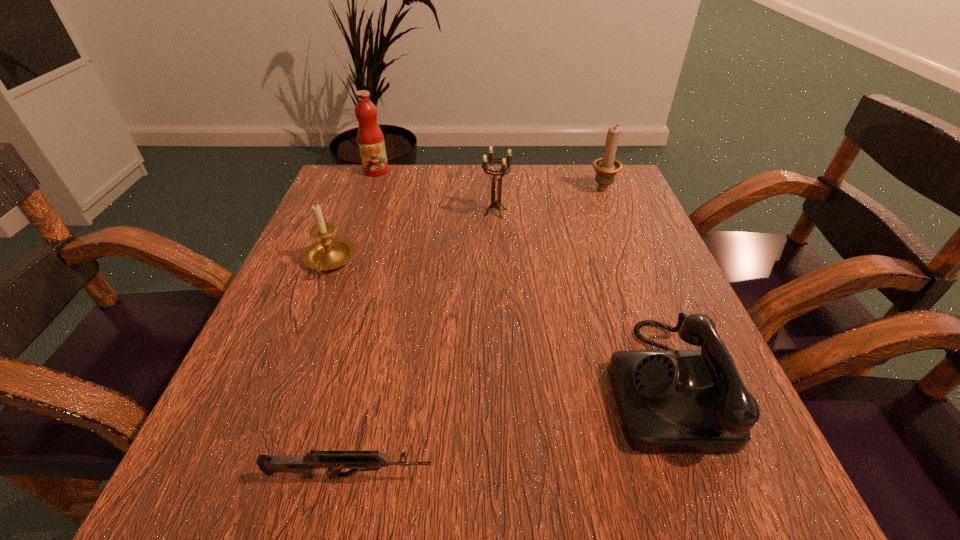
Identify the location of vacant area that lies between the tallest object and the farthest candle holder. The height and width of the screenshot is (540, 960). (489, 179).

The width and height of the screenshot is (960, 540). Identify the location of free space between the fifth nearest object and the farthest object. (489, 179).

Where is `vacant space that's between the nearest candle holder and the second candle holder from left to right`? vacant space that's between the nearest candle holder and the second candle holder from left to right is located at coordinates (413, 237).

Locate an element on the screen. This screenshot has height=540, width=960. unoccupied area between the telephone and the shortest object is located at coordinates (506, 430).

The height and width of the screenshot is (540, 960). In order to click on free space between the nearest object and the telephone in this screenshot , I will do `click(506, 430)`.

I want to click on empty space between the second candle holder from left to right and the telephone, so click(579, 298).

The height and width of the screenshot is (540, 960). Identify the location of object that is the fourth closest one to the farthest candle holder. (329, 253).

Find the location of a particular element. object that is the closest one to the tallest object is located at coordinates (496, 204).

Identify which candle holder is located as the nearest to the second candle holder from right to left. Please provide its 2D coordinates. Your answer should be formatted as a tuple, i.e. [(x, y)], where the tuple contains the x and y coordinates of a point satisfying the conditions above.

[(606, 168)]

Choose which candle holder is the third nearest neighbor to the fifth farthest object. Please provide its 2D coordinates. Your answer should be formatted as a tuple, i.e. [(x, y)], where the tuple contains the x and y coordinates of a point satisfying the conditions above.

[(329, 253)]